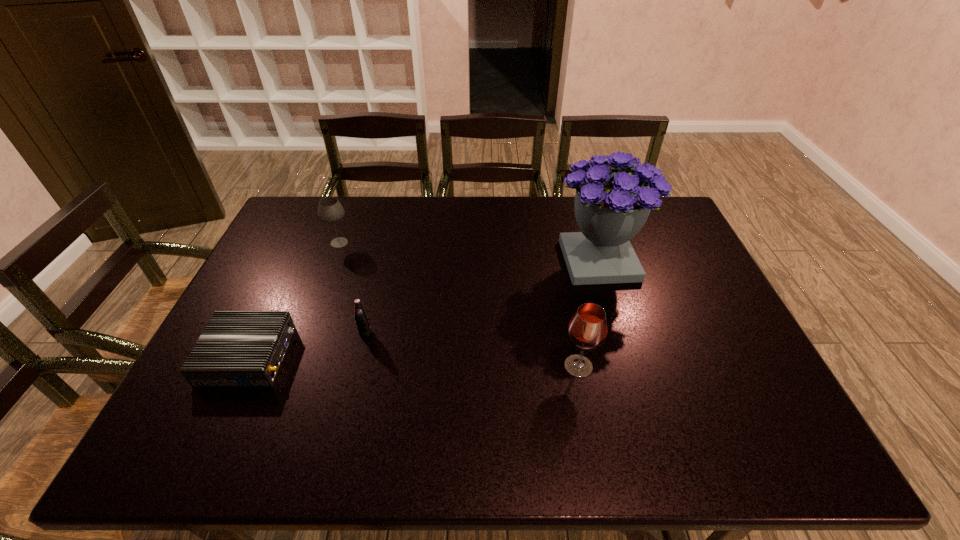
At what (x,y) coordinates should I click in order to perform the action: click on free space located 0.110m on the back of the third tallest object. Please return your answer as a coordinate pair (x, y). Looking at the image, I should click on (348, 217).

The image size is (960, 540). Identify the location of vacant space situated on the front label of the second shortest object. (335, 460).

The image size is (960, 540). In order to click on vacant space located on the back panel of the shortest object in this screenshot , I will do `click(416, 356)`.

Identify the location of bouquet situated at the far edge. This screenshot has height=540, width=960. (611, 206).

Find the location of a particular element. This screenshot has height=540, width=960. wineglass located in the far edge section of the desktop is located at coordinates (330, 210).

The width and height of the screenshot is (960, 540). I want to click on object present at the left edge, so click(x=237, y=348).

Locate an element on the screen. vacant space at the far edge of the desktop is located at coordinates (527, 218).

What are the coordinates of `vacant space at the near edge of the desktop` in the screenshot? It's located at (716, 425).

The height and width of the screenshot is (540, 960). In the image, there is a desktop. What are the coordinates of `free space at the left edge` in the screenshot? It's located at (282, 255).

Locate an element on the screen. The image size is (960, 540). vacant region at the right edge is located at coordinates (751, 373).